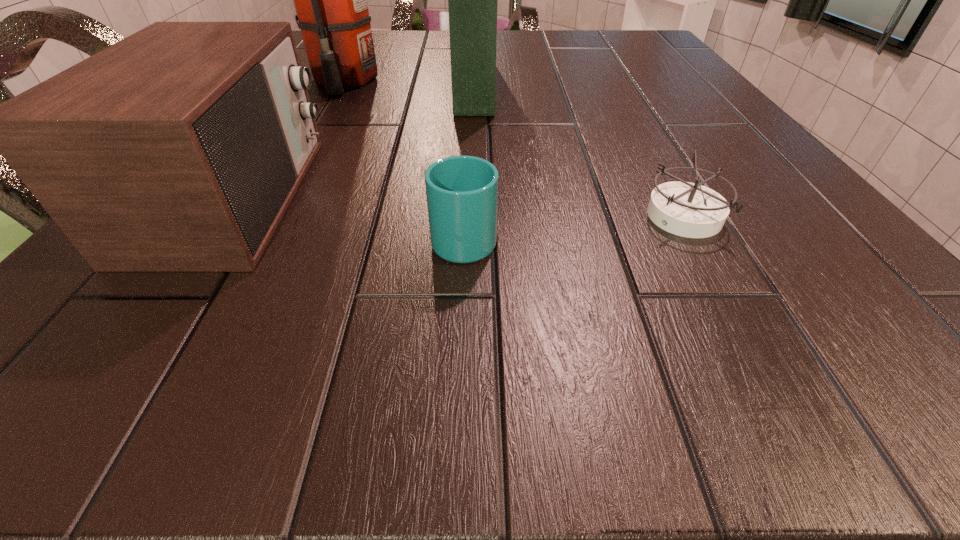
Where is `fire extinguisher`? This screenshot has height=540, width=960. fire extinguisher is located at coordinates (330, 0).

Locate an element on the screen. The image size is (960, 540). the second tallest object is located at coordinates pos(472,0).

Where is `the third shortest object`? the third shortest object is located at coordinates (178, 149).

At what (x,y) coordinates should I click in order to perform the action: click on the fourth tallest object. Please return your answer as a coordinate pair (x, y). The image size is (960, 540). Looking at the image, I should click on (462, 191).

Locate an element on the screen. The height and width of the screenshot is (540, 960). the rightmost object is located at coordinates (686, 209).

You are a GUI agent. You are given a task and a screenshot of the screen. Output one action in this format:
    pyautogui.click(x=<x>, y=<y>)
    Task: Click on the compass
    The width and height of the screenshot is (960, 540).
    Given the screenshot: What is the action you would take?
    pyautogui.click(x=686, y=209)

The height and width of the screenshot is (540, 960). Identify the location of vacant space located 0.270m on the nozzle of the fire extinguisher. (284, 181).

Locate an element on the screen. blank space located 0.220m on the front-facing side of the second tallest object is located at coordinates pos(600,85).

The width and height of the screenshot is (960, 540). I want to click on free space located 0.150m on the front-facing side of the third shortest object, so click(x=417, y=198).

The height and width of the screenshot is (540, 960). I want to click on vacant space located 0.080m on the handle side of the second shortest object, so click(467, 180).